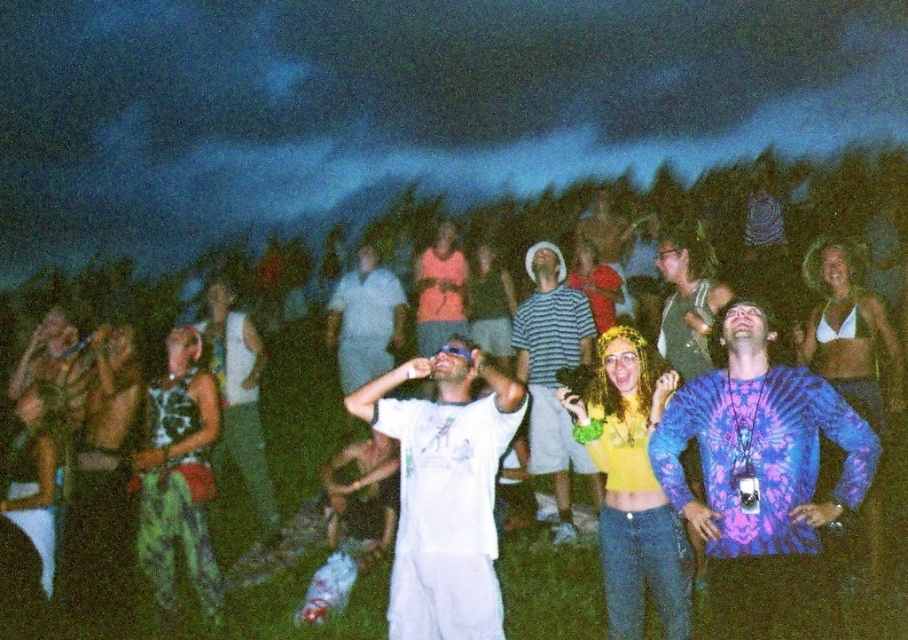
Can you confirm if white cotton t-shirt at center is smaller than white cotton shirt at center?

Yes.

Which is behind, point (448, 595) or point (372, 339)?

The point (372, 339) is behind.

The width and height of the screenshot is (908, 640). In order to click on white cotton t-shirt at center in this screenshot , I will do `click(445, 492)`.

Between point (787, 588) and point (538, 346), which one is positioned in front?

Point (787, 588) is in front.

Which is above, tie-dye fabric shirt at right or striped cotton shirt at center?

striped cotton shirt at center is higher up.

Who is more forward, (793, 630) or (587, 352)?

Point (793, 630)

Identify the location of tie-dye fabric shirt at right. The image size is (908, 640). (761, 480).

Does point (461, 412) come behind point (568, 481)?

No, (461, 412) is closer to viewer.

Based on the photo, does white cotton t-shirt at center lie in front of striped cotton shirt at center?

Yes, it is.

Is point (383, 403) farther from camera compared to point (517, 307)?

No, it is not.

Identify the location of white cotton t-shirt at center. (445, 492).